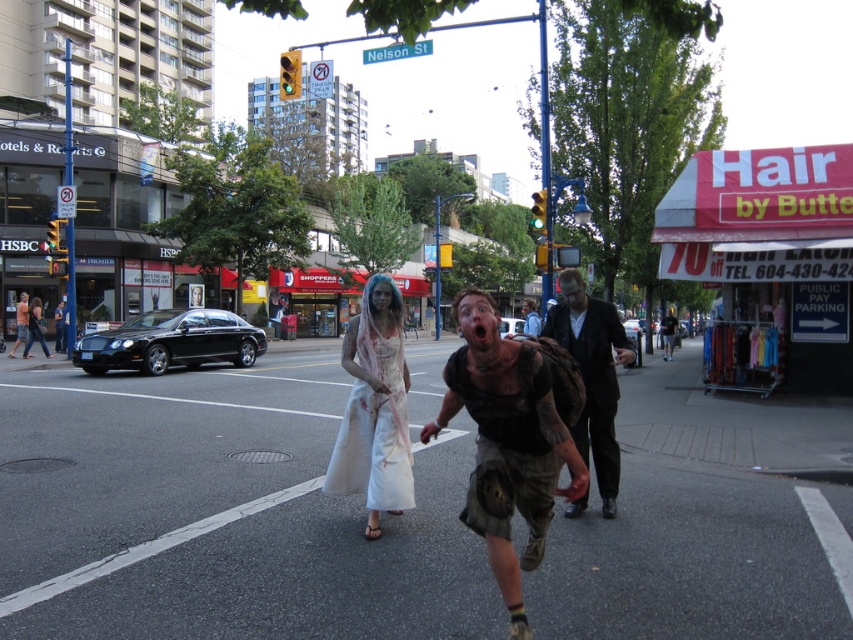
From the picture: You are standing at the point labeled point (546, 419) in the image. You want to throw a pumpkin to a friend who is standing 4 meters away from you. Will you be able to reach your friend with the pumpkin?

The distance between you and your friend is 4 meters, but the point labeled point (546, 419) is only 3.39 meters away from the viewer. Therefore, you cannot reach your friend who is 4 meters away.

You are a costume designer evaluating two Halloween costumes displayed in the center of an urban street scene. The costumes are the black matte tank top at center and the white cotton dress at center. Based on their visual presence, which costume takes up more space and would be more noticeable to onlookers?

The white cotton dress at center occupies more space than the black matte tank top at center, making it more noticeable to onlookers.

You are a costume designer observing the urban street scene. You notice the black matte tank top at center and the dark brown leather jacket at center. Which costume item is positioned closer to the front of the scene?

The black matte tank top at center is positioned in front of the dark brown leather jacket at center, making it closer to the front of the scene.